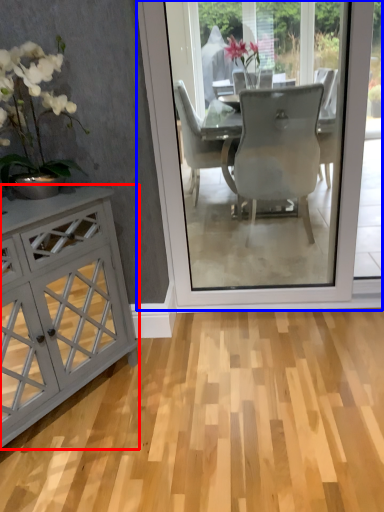
Question: Which object appears farthest to the camera in this image, cabinetry (highlighted by a red box) or screen door (highlighted by a blue box)?

Choices:
 (A) cabinetry
 (B) screen door

Answer: (B)